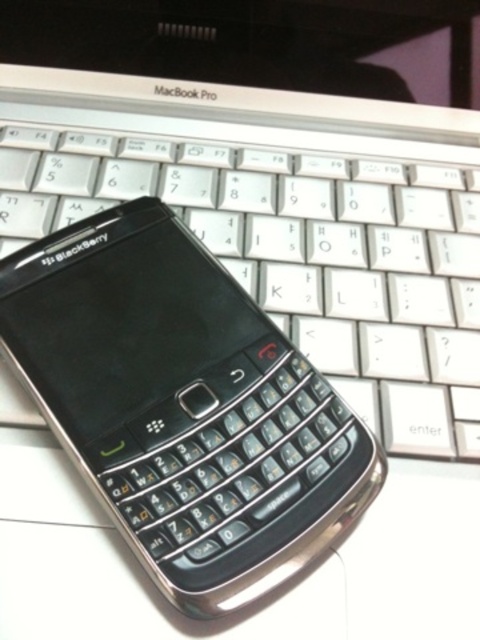
Is black plastic smartphone at center bigger than white plastic keyboard at center?

No, black plastic smartphone at center is not bigger than white plastic keyboard at center.

Is black plastic smartphone at center shorter than white plastic keyboard at center?

Yes, black plastic smartphone at center is shorter than white plastic keyboard at center.

What do you see at coordinates (183, 404) in the screenshot? I see `black plastic smartphone at center` at bounding box center [183, 404].

The width and height of the screenshot is (480, 640). In order to click on black plastic smartphone at center in this screenshot , I will do `click(183, 404)`.